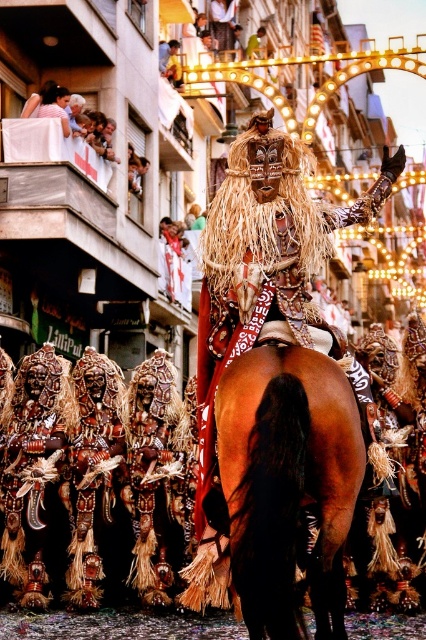
You are a photographer standing at the camera position. You want to take a closeup shot of the brown glossy horse at center. Considering the distance between you and the horse, what is the minimum focal length lens you should use to fill the frame? Assume the horse occupies 20 degrees of your field of view when at 1 meter distance. The camera sensor has a diagonal measurement of 27.94mm.

The minimum focal length lens required is approximately 50mm. This is calculated using the formula focal length equals sensor diagonal divided by twice the tangent of half the field of view angle. Here, tan 10 degrees gives 0.1763, so 27.94mm divided by 2 times 0.1763 equals roughly 50mm. This allows the brown glossy horse at center to fill the frame adequately at the given distance.

You are a photographer standing at the camera position. You want to capture a closeup shot of the point at coordinates (259, 182). Given that your telephoto lens can focus on subjects within 150 feet, will you need to adjust your position to get a clear shot?

The point at coordinates (259, 182) is 173.85 feet away from the camera. Since the telephoto lens can only focus within 150 feet, you will need to move closer to ensure the subject is within the lens range.

Consider the image. In the festival scene, you notice the shiny metallic mask at center and the light brown wooden balcony at upper left. Which object appears bigger in the image?

The shiny metallic mask at center has a larger size compared to the light brown wooden balcony at upper left, so the shiny metallic mask at center appears bigger.